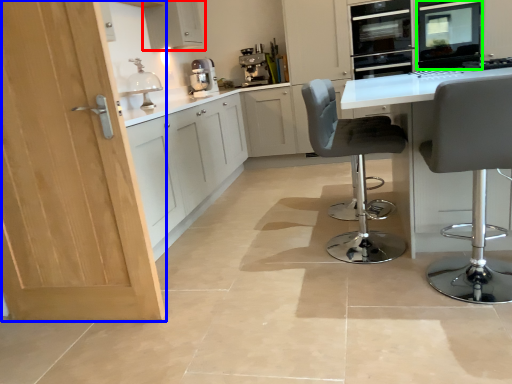
Question: Which object is the farthest from cabinetry (highlighted by a red box)? Choose among these: door (highlighted by a blue box) or appliance (highlighted by a green box).

Choices:
 (A) door
 (B) appliance

Answer: (A)